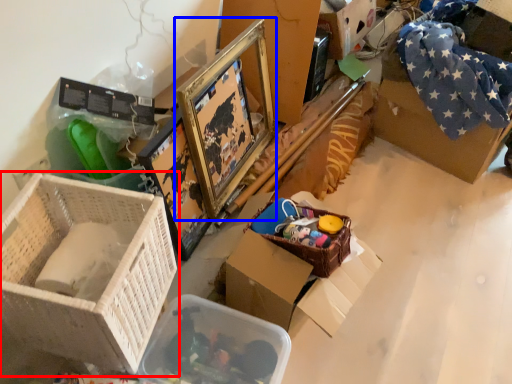
Question: Which point is closer to the camera, box (highlighted by a red box) or picture frame (highlighted by a blue box)?

Choices:
 (A) box
 (B) picture frame

Answer: (A)